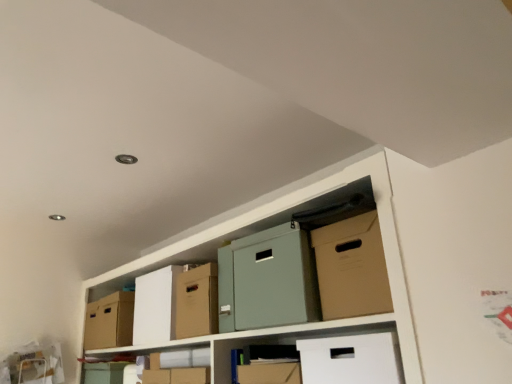
Question: From the image's perspective, is cardboard box at center, marked as the second cardboard box in a right-to-left arrangement, over cardboard box at left, placed as the 3th cardboard box when sorted from front to back?

Choices:
 (A) no
 (B) yes

Answer: (B)

Question: From a real-world perspective, is cardboard box at center, marked as the second cardboard box in a right-to-left arrangement, positioned under cardboard box at left, placed as the 3th cardboard box when sorted from front to back, based on gravity?

Choices:
 (A) yes
 (B) no

Answer: (B)

Question: Can you confirm if cardboard box at center, placed as the second cardboard box when sorted from front to back, is positioned to the left of cardboard box at left, marked as the 3th cardboard box in a right-to-left arrangement?

Choices:
 (A) yes
 (B) no

Answer: (B)

Question: From a real-world perspective, is cardboard box at center, which is the 2th cardboard box from back to front, over cardboard box at left, marked as the 3th cardboard box in a right-to-left arrangement?

Choices:
 (A) yes
 (B) no

Answer: (A)

Question: Would you say cardboard box at center, placed as the second cardboard box when sorted from front to back, is a long distance from cardboard box at left, arranged as the 1th cardboard box when viewed from the left?

Choices:
 (A) yes
 (B) no

Answer: (B)

Question: Is matte cardboard box at lower center in front of or behind matte cardboard box at center in the image?

Choices:
 (A) front
 (B) behind

Answer: (B)

Question: From a real-world perspective, is matte cardboard box at lower center physically located above or below matte cardboard box at center?

Choices:
 (A) above
 (B) below

Answer: (B)

Question: Considering the positions of matte cardboard box at lower center and matte cardboard box at center in the image, is matte cardboard box at lower center taller or shorter than matte cardboard box at center?

Choices:
 (A) short
 (B) tall

Answer: (A)

Question: Is matte cardboard box at lower center spatially inside matte cardboard box at center, or outside of it?

Choices:
 (A) inside
 (B) outside

Answer: (B)

Question: Based on their sizes in the image, would you say cardboard box at center, marked as the second cardboard box in a right-to-left arrangement, is bigger or smaller than matte cardboard box at center?

Choices:
 (A) small
 (B) big

Answer: (A)

Question: Is cardboard box at center, placed as the second cardboard box when sorted from front to back, in front of or behind matte cardboard box at center in the image?

Choices:
 (A) behind
 (B) front

Answer: (A)

Question: From their relative heights in the image, would you say cardboard box at center, which is the 2th cardboard box from back to front, is taller or shorter than matte cardboard box at center?

Choices:
 (A) short
 (B) tall

Answer: (B)

Question: From a real-world perspective, relative to matte cardboard box at center, is cardboard box at center, the 2th cardboard box when ordered from left to right, vertically above or below?

Choices:
 (A) above
 (B) below

Answer: (A)

Question: Is matte cardboard box at center taller or shorter than cardboard box at center, which is the 2th cardboard box from back to front?

Choices:
 (A) short
 (B) tall

Answer: (A)

Question: In terms of width, does matte cardboard box at center look wider or thinner when compared to cardboard box at center, the 2th cardboard box when ordered from left to right?

Choices:
 (A) wide
 (B) thin

Answer: (A)